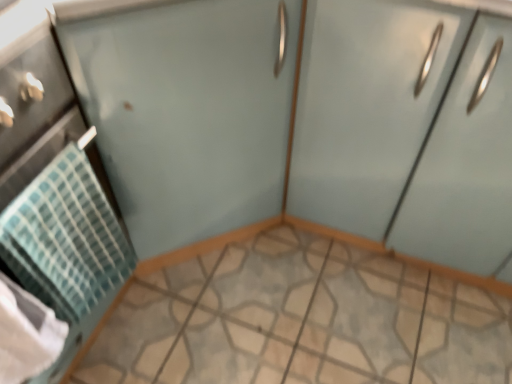
Question: Is clear glass screen door at upper right directly adjacent to matte light blue cabinet at right?

Choices:
 (A) no
 (B) yes

Answer: (A)

Question: Does clear glass screen door at upper right have a smaller size compared to matte light blue cabinet at right?

Choices:
 (A) yes
 (B) no

Answer: (B)

Question: From the image's perspective, is clear glass screen door at upper right under matte light blue cabinet at right?

Choices:
 (A) no
 (B) yes

Answer: (A)

Question: From a real-world perspective, is clear glass screen door at upper right positioned under matte light blue cabinet at right based on gravity?

Choices:
 (A) no
 (B) yes

Answer: (A)

Question: Are clear glass screen door at upper right and matte light blue cabinet at right far apart?

Choices:
 (A) yes
 (B) no

Answer: (B)

Question: Is matte light blue cabinet at right at the back of clear glass screen door at upper right?

Choices:
 (A) yes
 (B) no

Answer: (B)

Question: Considering the relative sizes of teal woven towel at left and matte teal towel at left in the image provided, is teal woven towel at left smaller than matte teal towel at left?

Choices:
 (A) no
 (B) yes

Answer: (B)

Question: From a real-world perspective, is teal woven towel at left on top of matte teal towel at left?

Choices:
 (A) yes
 (B) no

Answer: (A)

Question: Is matte teal towel at left at the back of teal woven towel at left?

Choices:
 (A) no
 (B) yes

Answer: (B)

Question: Is matte teal towel at left surrounded by teal woven towel at left?

Choices:
 (A) yes
 (B) no

Answer: (B)

Question: Does teal woven towel at left appear on the left side of matte teal towel at left?

Choices:
 (A) no
 (B) yes

Answer: (A)

Question: From the image's perspective, does teal woven towel at left appear higher than matte teal towel at left?

Choices:
 (A) yes
 (B) no

Answer: (A)

Question: Does matte light blue cabinet at right come in front of matte teal towel at left?

Choices:
 (A) yes
 (B) no

Answer: (B)